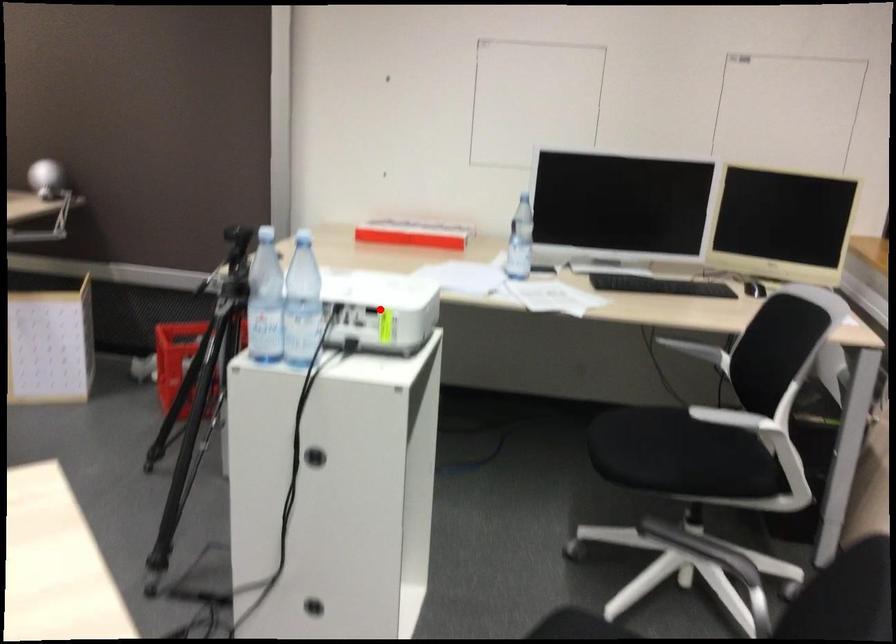
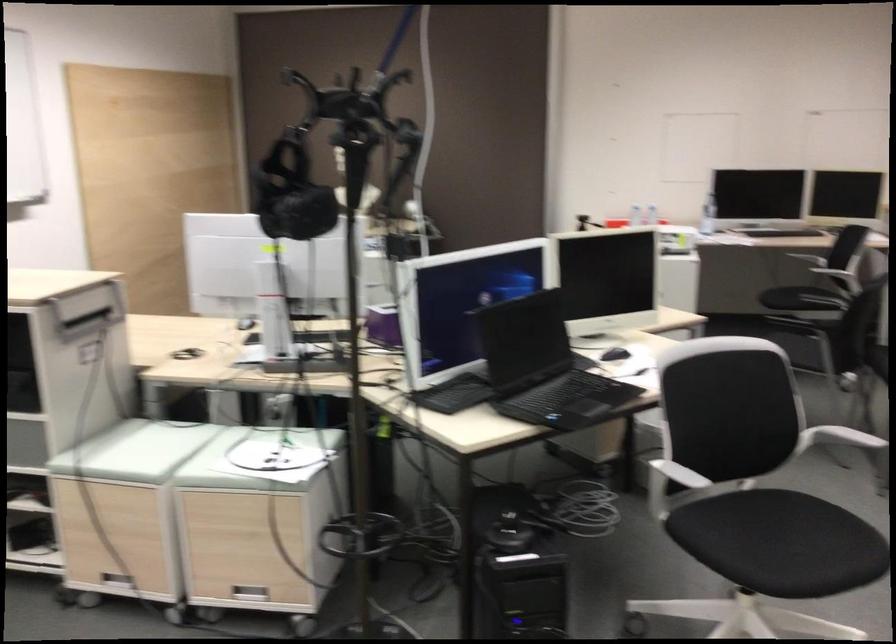
Question: I am providing you with two images of the same scene from different viewpoints. A red point is marked on the first image. At the location where the point appears in image 1, is it still visible in image 2?

Choices:
 (A) Yes
 (B) No

Answer: (B)